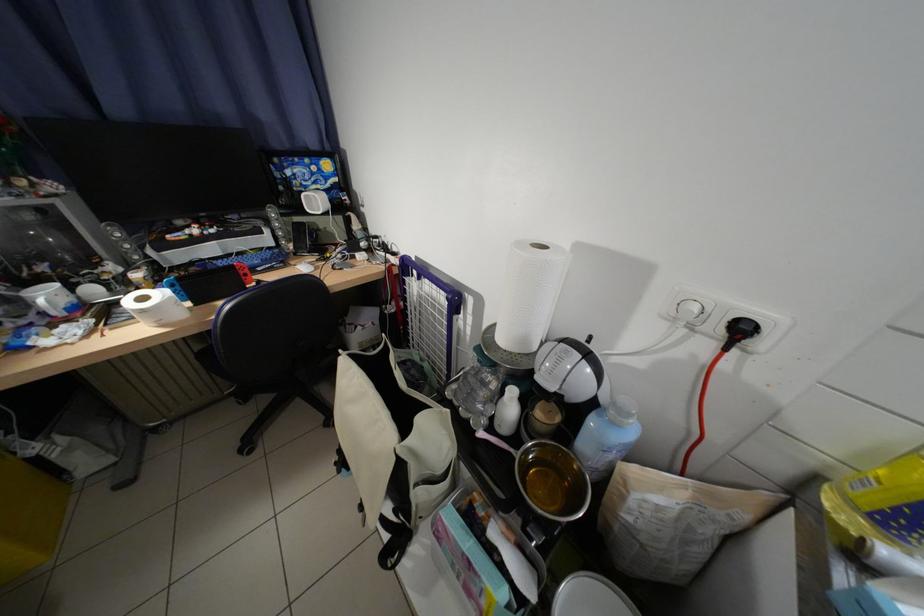
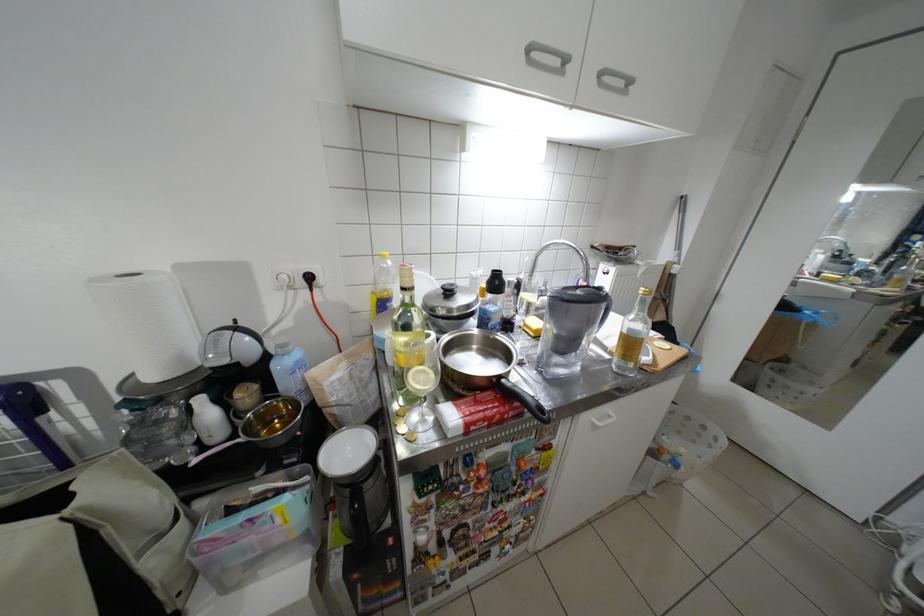
Question: The camera is either moving clockwise (left) or counter-clockwise (right) around the object. The first image is from the beginning of the video and the second image is from the end. Is the camera moving left or right when shooting the video?

Choices:
 (A) Left
 (B) Right

Answer: (A)